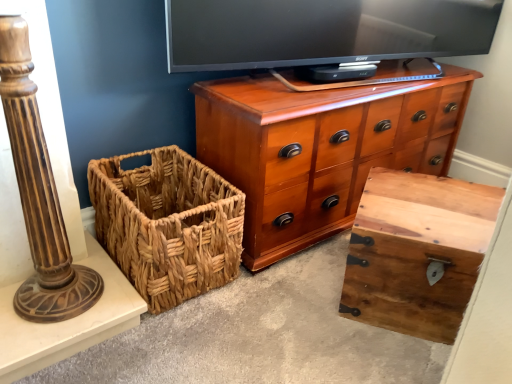
I want to click on rustic wood trunk at center, so click(x=417, y=252).

What do you see at coordinates (320, 148) in the screenshot? This screenshot has width=512, height=384. I see `shiny wood chest of drawers at center` at bounding box center [320, 148].

Locate an element on the screen. brown polished wood column at left is located at coordinates (39, 194).

What's the angular difference between brown polished wood column at left and woven brown basket at lower left's facing directions?

They differ by 2.23 degrees in their facing directions.

Does brown polished wood column at left have a greater height compared to woven brown basket at lower left?

Correct, brown polished wood column at left is much taller as woven brown basket at lower left.

Based on the photo, is brown polished wood column at left closer to camera compared to woven brown basket at lower left?

Yes, brown polished wood column at left is closer to the viewer.

Which is correct: brown polished wood column at left is inside woven brown basket at lower left, or outside of it?

The correct answer is: outside.

Considering the sizes of objects rustic wood trunk at center and brown polished wood column at left in the image provided, who is bigger, rustic wood trunk at center or brown polished wood column at left?

With larger size is rustic wood trunk at center.

Looking at this image, is rustic wood trunk at center inside the boundaries of brown polished wood column at left, or outside?

rustic wood trunk at center is outside brown polished wood column at left.

Where is `pillar that is in front of the rustic wood trunk at center`? pillar that is in front of the rustic wood trunk at center is located at coordinates (39, 194).

Is rustic wood trunk at center at the left side of brown polished wood column at left?

No, rustic wood trunk at center is not to the left of brown polished wood column at left.

From the image's perspective, which object appears higher, rustic wood trunk at center or shiny wood chest of drawers at center?

shiny wood chest of drawers at center is shown above in the image.

Is rustic wood trunk at center with shiny wood chest of drawers at center?

They are not placed beside each other.

Does rustic wood trunk at center contain shiny wood chest of drawers at center?

No, shiny wood chest of drawers at center is not inside rustic wood trunk at center.

In the image, is rustic wood trunk at center on the left side or the right side of shiny wood chest of drawers at center?

Clearly, rustic wood trunk at center is on the right of shiny wood chest of drawers at center in the image.

Is woven brown basket at lower left directly adjacent to brown polished wood column at left?

No.

From the image's perspective, is woven brown basket at lower left positioned above or below brown polished wood column at left?

Based on their image positions, woven brown basket at lower left is located beneath brown polished wood column at left.

Considering the sizes of objects woven brown basket at lower left and brown polished wood column at left in the image provided, who is thinner, woven brown basket at lower left or brown polished wood column at left?

With smaller width is brown polished wood column at left.

Which object is closer to the camera, woven brown basket at lower left or brown polished wood column at left?

Positioned in front is brown polished wood column at left.

Is brown polished wood column at left looking in the opposite direction of rustic wood trunk at center?

No.

From the image's perspective, which one is positioned higher, brown polished wood column at left or rustic wood trunk at center?

brown polished wood column at left appears higher in the image.

Where is `pillar lying above the rustic wood trunk at center (from the image's perspective)`? pillar lying above the rustic wood trunk at center (from the image's perspective) is located at coordinates (39, 194).

Would you say brown polished wood column at left is outside rustic wood trunk at center?

Yes.

Is shiny wood chest of drawers at center closer to camera compared to woven brown basket at lower left?

No, the depth of shiny wood chest of drawers at center is greater than that of woven brown basket at lower left.

From a real-world perspective, who is located higher, shiny wood chest of drawers at center or woven brown basket at lower left?

shiny wood chest of drawers at center is physically above.

Does shiny wood chest of drawers at center contain woven brown basket at lower left?

That's incorrect, woven brown basket at lower left is not inside shiny wood chest of drawers at center.

Could you tell me if woven brown basket at lower left is facing shiny wood chest of drawers at center?

No, woven brown basket at lower left is not aimed at shiny wood chest of drawers at center.

Where is `basket in front of the shiny wood chest of drawers at center`? This screenshot has height=384, width=512. basket in front of the shiny wood chest of drawers at center is located at coordinates (167, 224).

Does woven brown basket at lower left have a larger size compared to shiny wood chest of drawers at center?

No, woven brown basket at lower left is not bigger than shiny wood chest of drawers at center.

Is woven brown basket at lower left positioned behind shiny wood chest of drawers at center?

No, woven brown basket at lower left is in front of shiny wood chest of drawers at center.

Image resolution: width=512 pixels, height=384 pixels. I want to click on pillar in front of the woven brown basket at lower left, so click(x=39, y=194).

The image size is (512, 384). In order to click on storage box below the brown polished wood column at left (from a real-world perspective) in this screenshot , I will do `click(417, 252)`.

Based on their spatial positions, is rustic wood trunk at center or woven brown basket at lower left further from brown polished wood column at left?

Among the two, rustic wood trunk at center is located further to brown polished wood column at left.

From the image, which object appears to be farther from woven brown basket at lower left, shiny wood chest of drawers at center or rustic wood trunk at center?

rustic wood trunk at center.

Looking at the image, which one is located further to rustic wood trunk at center, shiny wood chest of drawers at center or brown polished wood column at left?

brown polished wood column at left is further to rustic wood trunk at center.

Based on their spatial positions, is rustic wood trunk at center or shiny wood chest of drawers at center further from woven brown basket at lower left?

Among the two, rustic wood trunk at center is located further to woven brown basket at lower left.

Considering their positions, is woven brown basket at lower left positioned closer to brown polished wood column at left than rustic wood trunk at center?

woven brown basket at lower left is positioned closer to the anchor brown polished wood column at left.

From the image, which object appears to be nearer to shiny wood chest of drawers at center, woven brown basket at lower left or brown polished wood column at left?

Among the two, woven brown basket at lower left is located nearer to shiny wood chest of drawers at center.

Considering their positions, is shiny wood chest of drawers at center positioned further to woven brown basket at lower left than brown polished wood column at left?

shiny wood chest of drawers at center.

Based on their spatial positions, is rustic wood trunk at center or brown polished wood column at left closer to woven brown basket at lower left?

brown polished wood column at left.

I want to click on basket situated between brown polished wood column at left and shiny wood chest of drawers at center from left to right, so click(x=167, y=224).

Identify the location of the chest of drawers located between woven brown basket at lower left and rustic wood trunk at center in the left-right direction. The width and height of the screenshot is (512, 384). (320, 148).

This screenshot has height=384, width=512. In order to click on the chest of drawers located between brown polished wood column at left and rustic wood trunk at center in the left-right direction in this screenshot , I will do `click(320, 148)`.

The height and width of the screenshot is (384, 512). I want to click on basket between brown polished wood column at left and rustic wood trunk at center, so click(x=167, y=224).